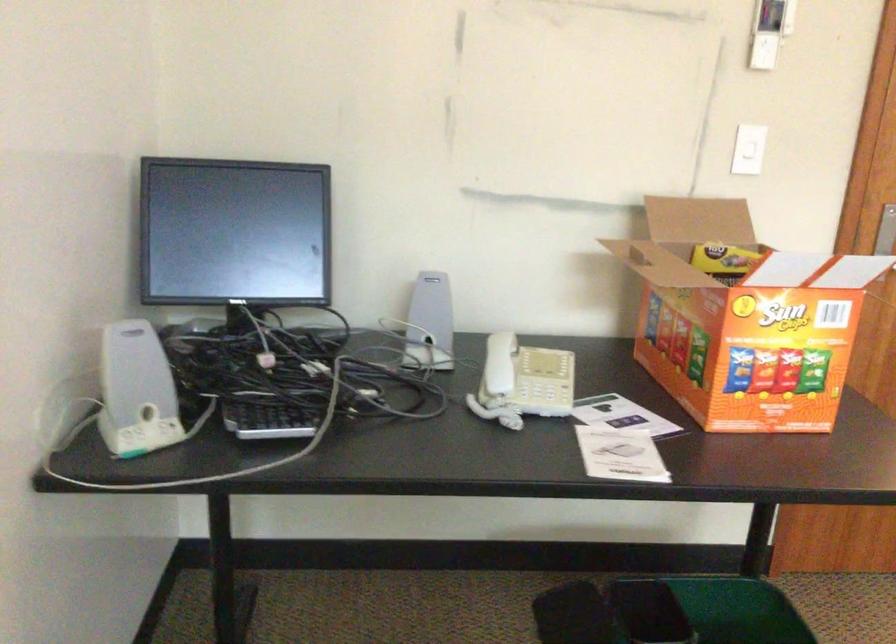
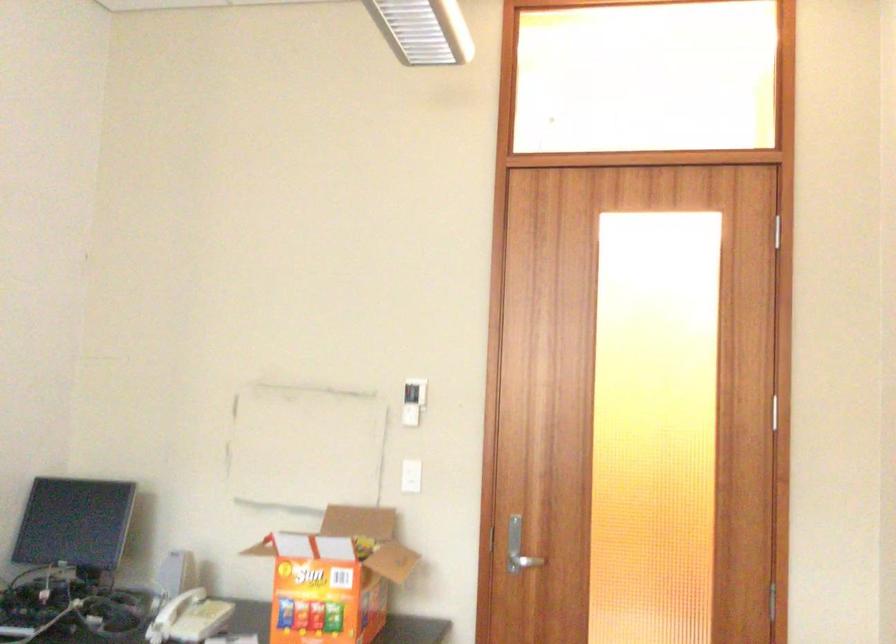
In the second image, find the point that corresponds to the point at 513,393 in the first image.

(170, 617)